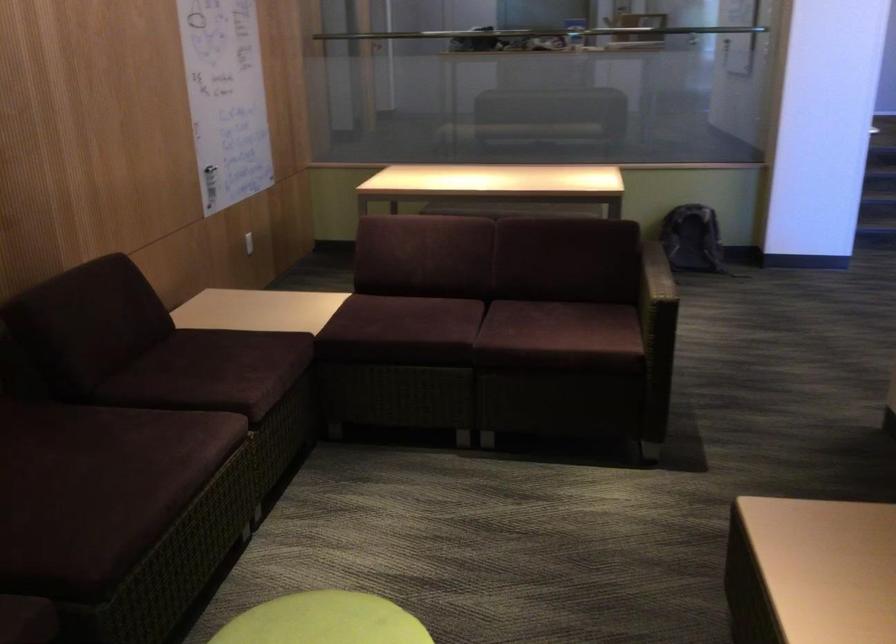
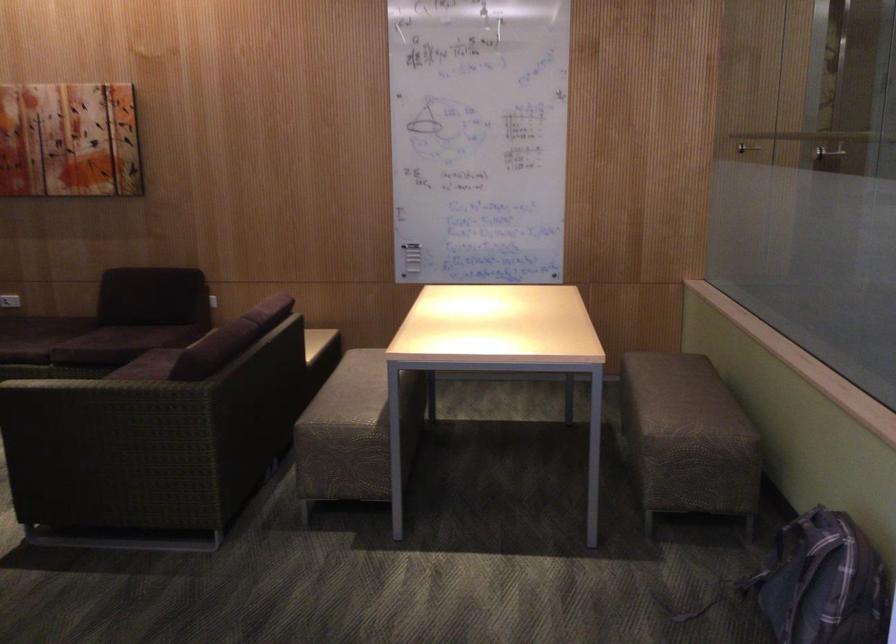
Find the pixel in the second image that matches (x=662, y=283) in the first image.

(96, 382)